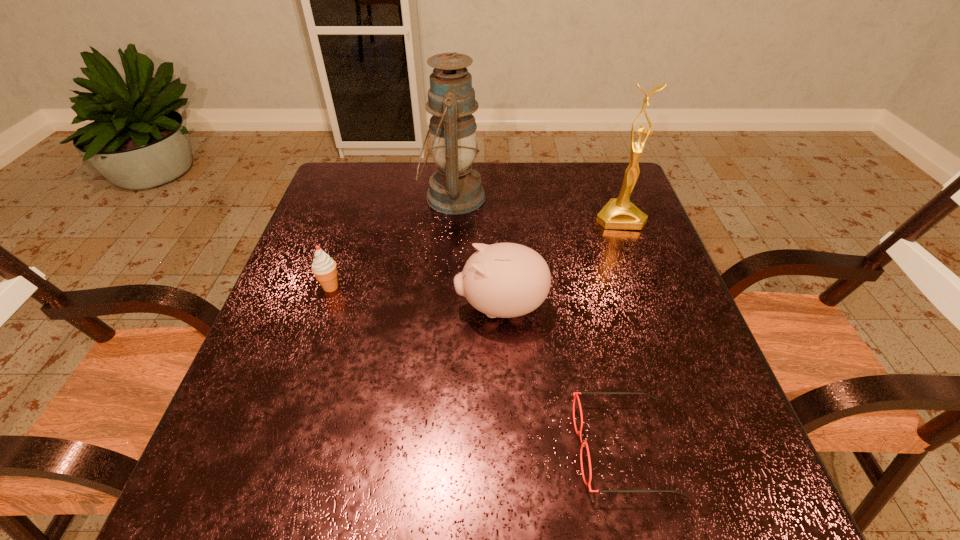
At what (x,y) coordinates should I click in order to perform the action: click on free point located 0.160m at the snout of the piggy bank. Please return your answer as a coordinate pair (x, y). This screenshot has width=960, height=540. Looking at the image, I should click on (383, 307).

Where is `free location located at the snout of the piggy bank`? The height and width of the screenshot is (540, 960). free location located at the snout of the piggy bank is located at coordinates (415, 307).

Where is `vacant region located on the back of the fourth tallest object`? Image resolution: width=960 pixels, height=540 pixels. vacant region located on the back of the fourth tallest object is located at coordinates (351, 223).

The height and width of the screenshot is (540, 960). What are the coordinates of `free region located on the front-facing side of the nearest object` in the screenshot? It's located at pos(430,448).

At what (x,y) coordinates should I click in order to perform the action: click on vacant space situated on the front-facing side of the nearest object. Please return your answer as a coordinate pair (x, y). Looking at the image, I should click on (342, 448).

Locate an element on the screen. The image size is (960, 540). free point located 0.070m on the front-facing side of the nearest object is located at coordinates (536, 448).

Locate an element on the screen. oil lamp that is at the far edge is located at coordinates (454, 189).

This screenshot has width=960, height=540. Identify the location of award located in the far edge section of the desktop. (619, 213).

The height and width of the screenshot is (540, 960). In order to click on object that is positioned at the near edge in this screenshot , I will do `click(575, 394)`.

The width and height of the screenshot is (960, 540). Find the location of `object that is at the left edge`. object that is at the left edge is located at coordinates [x=324, y=268].